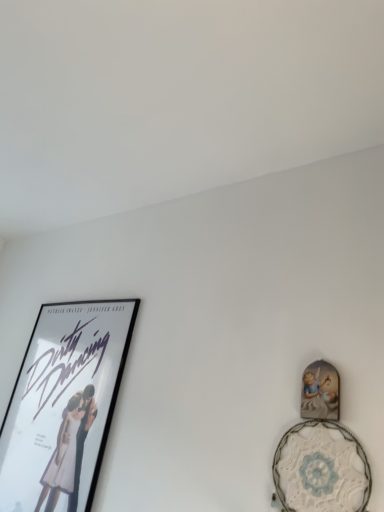
What do you see at coordinates (64, 405) in the screenshot?
I see `black glossy picture frame at left` at bounding box center [64, 405].

Locate an element on the screen. The height and width of the screenshot is (512, 384). black glossy picture frame at left is located at coordinates (64, 405).

The width and height of the screenshot is (384, 512). In order to click on black glossy picture frame at left in this screenshot , I will do `click(64, 405)`.